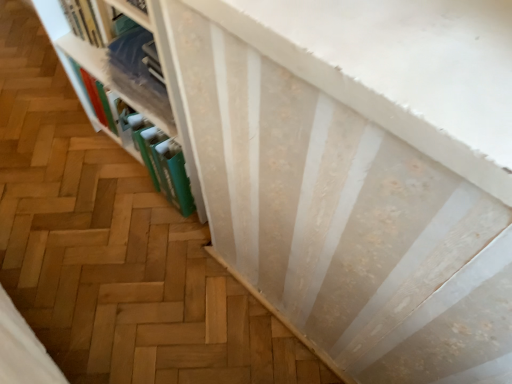
The height and width of the screenshot is (384, 512). Describe the element at coordinates (128, 84) in the screenshot. I see `white textured bookshelf at upper left` at that location.

Identify the location of white textured bookshelf at upper left. (128, 84).

Where is `white textured bookshelf at upper left`? The width and height of the screenshot is (512, 384). white textured bookshelf at upper left is located at coordinates (128, 84).